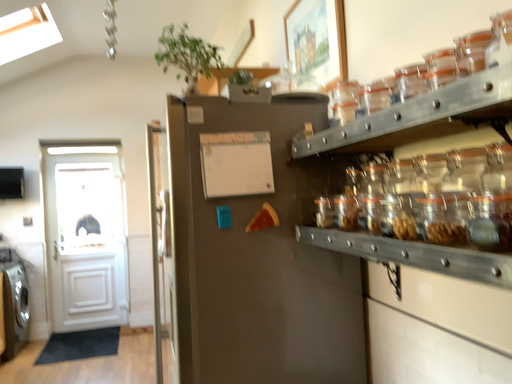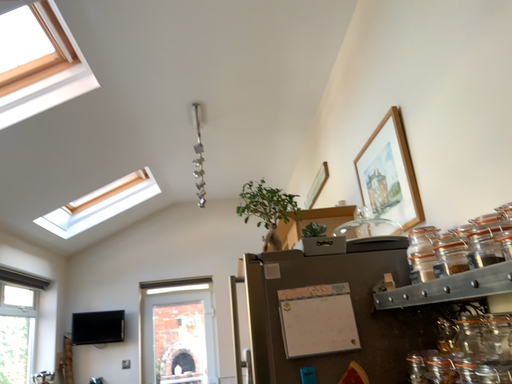
Question: Which way did the camera rotate in the video?

Choices:
 (A) rotated right
 (B) rotated left

Answer: (B)